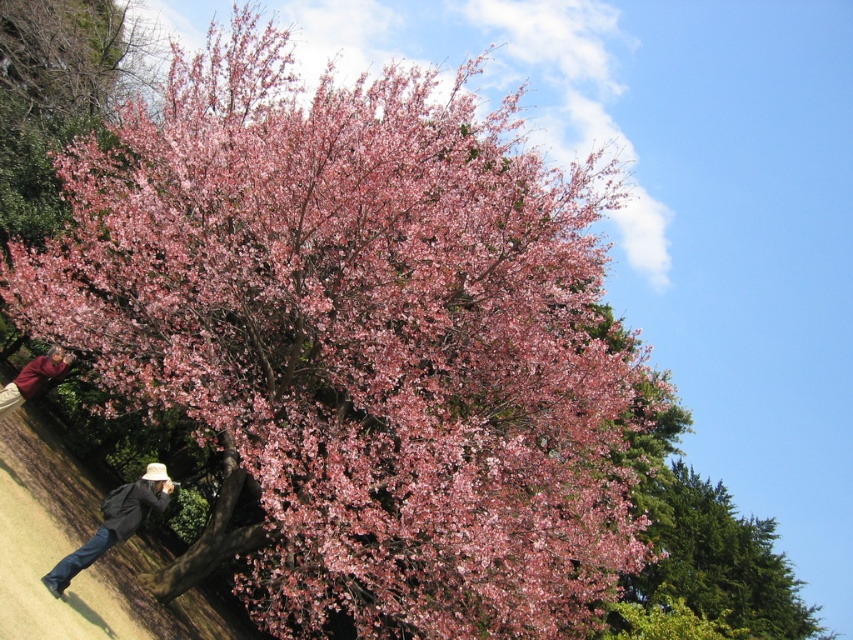
You are standing at the point marked as point (114, 525) in the image. What object is located exactly at this point?

The denim jacket at lower left is located exactly at point (114, 525).

You are a photographer aiming to capture both the denim jacket at lower left and the matte brown jacket at lower left in the same frame. Based on their positions, which jacket should you focus on first to ensure both are in the shot?

The denim jacket at lower left is below the matte brown jacket at lower left, so you should focus on the matte brown jacket at lower left first to ensure both are in the shot.

You are standing in a park and see the denim jacket at lower left. If you want to reach it quickly, should you walk straight ahead or turn around?

The denim jacket at lower left is 11.39 meters away from viewer, so you should walk straight ahead to reach it quickly.